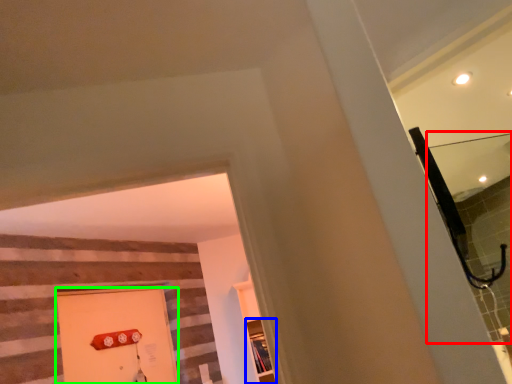
Question: Considering the real-world distances, which object is closest to mirror (highlighted by a red box)? shelf (highlighted by a blue box) or door (highlighted by a green box).

Choices:
 (A) shelf
 (B) door

Answer: (A)